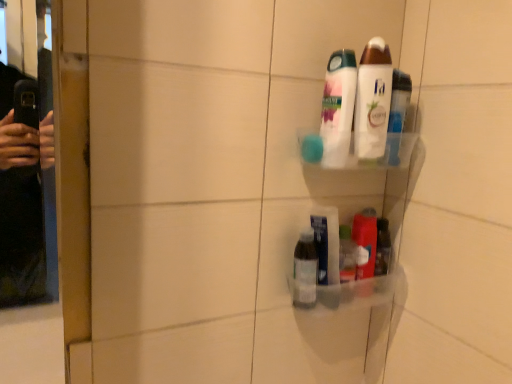
What do you see at coordinates (365, 248) in the screenshot?
I see `translucent plastic container at lower right, the 2th toiletry ordered from the bottom` at bounding box center [365, 248].

This screenshot has width=512, height=384. What do you see at coordinates (343, 264) in the screenshot? I see `transparent plastic bottle at lower center` at bounding box center [343, 264].

Where is `clear plastic bottle at lower center, the 4th toiletry in the top-to-bottom sequence`? clear plastic bottle at lower center, the 4th toiletry in the top-to-bottom sequence is located at coordinates (305, 270).

Considering the positions of objects translucent plastic container at lower right, which ranks as the 3th toiletry in top-to-bottom order, and clear plastic bottle at lower center, the 4th toiletry in the top-to-bottom sequence, in the image provided, who is behind, translucent plastic container at lower right, which ranks as the 3th toiletry in top-to-bottom order, or clear plastic bottle at lower center, the 4th toiletry in the top-to-bottom sequence,?

translucent plastic container at lower right, which ranks as the 3th toiletry in top-to-bottom order, is more distant.

Is translucent plastic container at lower right, which ranks as the 3th toiletry in top-to-bottom order, oriented away from clear plastic bottle at lower center, the 4th toiletry in the top-to-bottom sequence?

No, translucent plastic container at lower right, which ranks as the 3th toiletry in top-to-bottom order,'s orientation is not away from clear plastic bottle at lower center, the 4th toiletry in the top-to-bottom sequence.

Which of these two, translucent plastic container at lower right, which ranks as the 3th toiletry in top-to-bottom order, or clear plastic bottle at lower center, marked as the first toiletry in a bottom-to-top arrangement, is smaller?

Smaller between the two is clear plastic bottle at lower center, marked as the first toiletry in a bottom-to-top arrangement.

From the picture: Considering the positions of objects translucent plastic container at lower right, the 2th toiletry ordered from the bottom, and white glossy lotion at upper center, the 4th toiletry ordered from the bottom, in the image provided, who is behind, translucent plastic container at lower right, the 2th toiletry ordered from the bottom, or white glossy lotion at upper center, the 4th toiletry ordered from the bottom,?

Positioned behind is translucent plastic container at lower right, the 2th toiletry ordered from the bottom.

Is white glossy lotion at upper center, which is the 1th toiletry from top to bottom, completely or partially inside translucent plastic container at lower right, the 2th toiletry ordered from the bottom?

No, translucent plastic container at lower right, the 2th toiletry ordered from the bottom, does not contain white glossy lotion at upper center, which is the 1th toiletry from top to bottom.

Considering the sizes of translucent plastic container at lower right, the 2th toiletry ordered from the bottom, and white glossy lotion at upper center, the 4th toiletry ordered from the bottom, in the image, is translucent plastic container at lower right, the 2th toiletry ordered from the bottom, bigger or smaller than white glossy lotion at upper center, the 4th toiletry ordered from the bottom,?

In the image, translucent plastic container at lower right, the 2th toiletry ordered from the bottom, appears to be smaller than white glossy lotion at upper center, the 4th toiletry ordered from the bottom.

This screenshot has width=512, height=384. What are the coordinates of `the 2nd toiletry in front of the translucent plastic container at lower right, which ranks as the 3th toiletry in top-to-bottom order, counting from the anchor's position` in the screenshot? It's located at (373, 100).

Considering the points (386, 46) and (364, 263), which point is in front, point (386, 46) or point (364, 263)?

The point (386, 46) is closer.

Considering the positions of objects white glossy lotion at upper center, which is the 1th toiletry from top to bottom, and translucent plastic container at lower right, the 2th toiletry ordered from the bottom, in the image provided, who is more to the left, white glossy lotion at upper center, which is the 1th toiletry from top to bottom, or translucent plastic container at lower right, the 2th toiletry ordered from the bottom,?

From the viewer's perspective, white glossy lotion at upper center, which is the 1th toiletry from top to bottom, appears more on the left side.

In terms of width, does white glossy lotion at upper center, the 4th toiletry ordered from the bottom, look wider or thinner when compared to translucent plastic container at lower right, which ranks as the 3th toiletry in top-to-bottom order?

In the image, white glossy lotion at upper center, the 4th toiletry ordered from the bottom, appears to be more narrow than translucent plastic container at lower right, which ranks as the 3th toiletry in top-to-bottom order.

Are white glossy body wash at upper center, the 2th toiletry positioned from the top, and clear plastic bottle at lower center, marked as the first toiletry in a bottom-to-top arrangement, beside each other?

white glossy body wash at upper center, the 2th toiletry positioned from the top, is not next to clear plastic bottle at lower center, marked as the first toiletry in a bottom-to-top arrangement, and they're not touching.

How much distance is there between white glossy body wash at upper center, marked as the 3th toiletry in a bottom-to-top arrangement, and clear plastic bottle at lower center, the 4th toiletry in the top-to-bottom sequence?

They are 9.62 inches apart.

From the image's perspective, which object appears higher, white glossy body wash at upper center, marked as the 3th toiletry in a bottom-to-top arrangement, or clear plastic bottle at lower center, the 4th toiletry in the top-to-bottom sequence?

white glossy body wash at upper center, marked as the 3th toiletry in a bottom-to-top arrangement, appears higher in the image.

From a real-world perspective, is white glossy body wash at upper center, marked as the 3th toiletry in a bottom-to-top arrangement, over clear plastic bottle at lower center, marked as the first toiletry in a bottom-to-top arrangement?

Yes, from a real-world perspective, white glossy body wash at upper center, marked as the 3th toiletry in a bottom-to-top arrangement, is over clear plastic bottle at lower center, marked as the first toiletry in a bottom-to-top arrangement

Is white glossy body wash at upper center, the 2th toiletry positioned from the top, not within white glossy lotion at upper center, the 4th toiletry ordered from the bottom?

white glossy body wash at upper center, the 2th toiletry positioned from the top, lies outside white glossy lotion at upper center, the 4th toiletry ordered from the bottom,'s area.

There is a white glossy lotion at upper center, which is the 1th toiletry from top to bottom. Identify the location of the 1st toiletry below it (from a real-world perspective). (338, 107).

Between white glossy body wash at upper center, the 2th toiletry positioned from the top, and white glossy lotion at upper center, which is the 1th toiletry from top to bottom, which one has smaller size?

With smaller size is white glossy lotion at upper center, which is the 1th toiletry from top to bottom.

In the scene shown: Is white glossy body wash at upper center, marked as the 3th toiletry in a bottom-to-top arrangement, not close to white glossy lotion at upper center, which is the 1th toiletry from top to bottom?

Actually, white glossy body wash at upper center, marked as the 3th toiletry in a bottom-to-top arrangement, and white glossy lotion at upper center, which is the 1th toiletry from top to bottom, are a little close together.

Measure the distance from transparent plastic bottle at lower center to clear plastic bottle at lower center, the 4th toiletry in the top-to-bottom sequence.

A distance of 2.97 inches exists between transparent plastic bottle at lower center and clear plastic bottle at lower center, the 4th toiletry in the top-to-bottom sequence.

From the image's perspective, is transparent plastic bottle at lower center under clear plastic bottle at lower center, the 4th toiletry in the top-to-bottom sequence?

Incorrect, from the image's perspective, transparent plastic bottle at lower center is higher than clear plastic bottle at lower center, the 4th toiletry in the top-to-bottom sequence.

Is transparent plastic bottle at lower center far away from clear plastic bottle at lower center, marked as the first toiletry in a bottom-to-top arrangement?

No, transparent plastic bottle at lower center is in close proximity to clear plastic bottle at lower center, marked as the first toiletry in a bottom-to-top arrangement.

Is transparent plastic bottle at lower center turned away from clear plastic bottle at lower center, marked as the first toiletry in a bottom-to-top arrangement?

That's not correct — transparent plastic bottle at lower center is not looking away from clear plastic bottle at lower center, marked as the first toiletry in a bottom-to-top arrangement.

Measure the distance from transparent plastic bottle at lower center to white glossy body wash at upper center, the 2th toiletry positioned from the top.

A distance of 23.21 centimeters exists between transparent plastic bottle at lower center and white glossy body wash at upper center, the 2th toiletry positioned from the top.

Based on the photo, is the surface of transparent plastic bottle at lower center in direct contact with white glossy body wash at upper center, the 2th toiletry positioned from the top?

transparent plastic bottle at lower center and white glossy body wash at upper center, the 2th toiletry positioned from the top, are clearly separated.

How different are the orientations of transparent plastic bottle at lower center and white glossy body wash at upper center, marked as the 3th toiletry in a bottom-to-top arrangement, in degrees?

0.00481 degrees.

From the image's perspective, which toiletry is the 1st one above the transparent plastic bottle at lower center? Please provide its 2D coordinates.

[(338, 107)]

From a real-world perspective, which toiletry is the 1st one above the clear plastic bottle at lower center, marked as the first toiletry in a bottom-to-top arrangement? Please provide its 2D coordinates.

[(365, 248)]

Locate an element on the screen. The width and height of the screenshot is (512, 384). toiletry on the right of white glossy lotion at upper center, which is the 1th toiletry from top to bottom is located at coordinates (365, 248).

In the scene shown: Looking at the image, which one is located further to translucent plastic container at lower right, which ranks as the 3th toiletry in top-to-bottom order, white glossy lotion at upper center, the 4th toiletry ordered from the bottom, or clear plastic bottle at lower center, marked as the first toiletry in a bottom-to-top arrangement?

Based on the image, white glossy lotion at upper center, the 4th toiletry ordered from the bottom, appears to be further to translucent plastic container at lower right, which ranks as the 3th toiletry in top-to-bottom order.

Estimate the real-world distances between objects in this image. Which object is further from clear plastic bottle at lower center, marked as the first toiletry in a bottom-to-top arrangement, white glossy lotion at upper center, which is the 1th toiletry from top to bottom, or transparent plastic bottle at lower center?

white glossy lotion at upper center, which is the 1th toiletry from top to bottom.

When comparing their distances from clear plastic bottle at lower center, the 4th toiletry in the top-to-bottom sequence, does white glossy lotion at upper center, the 4th toiletry ordered from the bottom, or white glossy body wash at upper center, marked as the 3th toiletry in a bottom-to-top arrangement, seem closer?

white glossy body wash at upper center, marked as the 3th toiletry in a bottom-to-top arrangement, is positioned closer to the anchor clear plastic bottle at lower center, the 4th toiletry in the top-to-bottom sequence.

Estimate the real-world distances between objects in this image. Which object is further from transparent plastic bottle at lower center, white glossy lotion at upper center, the 4th toiletry ordered from the bottom, or translucent plastic container at lower right, which ranks as the 3th toiletry in top-to-bottom order?

white glossy lotion at upper center, the 4th toiletry ordered from the bottom, lies further to transparent plastic bottle at lower center than the other object.

Which object lies further to the anchor point transparent plastic bottle at lower center, clear plastic bottle at lower center, the 4th toiletry in the top-to-bottom sequence, or white glossy lotion at upper center, the 4th toiletry ordered from the bottom?

Among the two, white glossy lotion at upper center, the 4th toiletry ordered from the bottom, is located further to transparent plastic bottle at lower center.

Based on their spatial positions, is white glossy lotion at upper center, which is the 1th toiletry from top to bottom, or translucent plastic container at lower right, which ranks as the 3th toiletry in top-to-bottom order, further from clear plastic bottle at lower center, marked as the first toiletry in a bottom-to-top arrangement?

Among the two, white glossy lotion at upper center, which is the 1th toiletry from top to bottom, is located further to clear plastic bottle at lower center, marked as the first toiletry in a bottom-to-top arrangement.

Which object lies nearer to the anchor point translucent plastic container at lower right, the 2th toiletry ordered from the bottom, white glossy body wash at upper center, marked as the 3th toiletry in a bottom-to-top arrangement, or clear plastic bottle at lower center, marked as the first toiletry in a bottom-to-top arrangement?

Based on the image, clear plastic bottle at lower center, marked as the first toiletry in a bottom-to-top arrangement, appears to be nearer to translucent plastic container at lower right, the 2th toiletry ordered from the bottom.

When comparing their distances from white glossy body wash at upper center, marked as the 3th toiletry in a bottom-to-top arrangement, does white glossy lotion at upper center, which is the 1th toiletry from top to bottom, or translucent plastic container at lower right, the 2th toiletry ordered from the bottom, seem further?

Among the two, translucent plastic container at lower right, the 2th toiletry ordered from the bottom, is located further to white glossy body wash at upper center, marked as the 3th toiletry in a bottom-to-top arrangement.

The height and width of the screenshot is (384, 512). What are the coordinates of `product between white glossy lotion at upper center, which is the 1th toiletry from top to bottom, and clear plastic bottle at lower center, the 4th toiletry in the top-to-bottom sequence, from top to bottom` in the screenshot? It's located at (343, 264).

Locate an element on the screen. This screenshot has width=512, height=384. toiletry between white glossy lotion at upper center, the 4th toiletry ordered from the bottom, and transparent plastic bottle at lower center, in the vertical direction is located at coordinates (338, 107).

Locate an element on the screen. The width and height of the screenshot is (512, 384). toiletry between white glossy body wash at upper center, the 2th toiletry positioned from the top, and clear plastic bottle at lower center, the 4th toiletry in the top-to-bottom sequence, vertically is located at coordinates (365, 248).

The image size is (512, 384). Find the location of `product between white glossy body wash at upper center, marked as the 3th toiletry in a bottom-to-top arrangement, and clear plastic bottle at lower center, the 4th toiletry in the top-to-bottom sequence, in the up-down direction`. product between white glossy body wash at upper center, marked as the 3th toiletry in a bottom-to-top arrangement, and clear plastic bottle at lower center, the 4th toiletry in the top-to-bottom sequence, in the up-down direction is located at coordinates (343, 264).